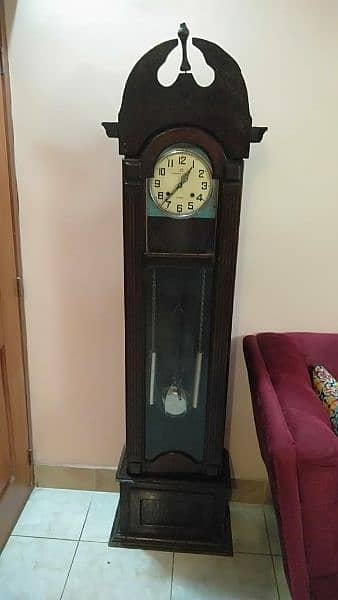
Image resolution: width=338 pixels, height=600 pixels. I want to click on wood frame, so click(x=123, y=527).